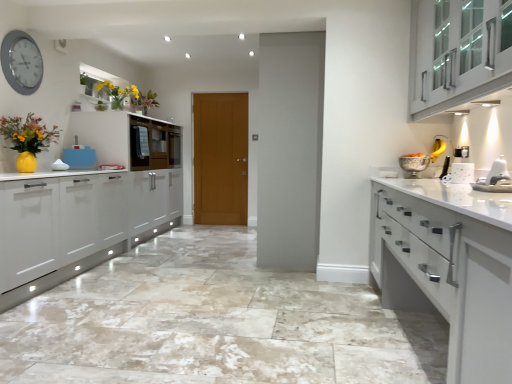
Question: Is white glossy cabinet at right, which is the second cabinetry in left-to-right order, a part of matte glass vase at upper left, the first floral arrangement when ordered from back to front?

Choices:
 (A) yes
 (B) no

Answer: (B)

Question: Is matte glass vase at upper left, the first floral arrangement viewed from the right, looking in the opposite direction of white glossy cabinet at right, marked as the 1th cabinetry in a front-to-back arrangement?

Choices:
 (A) no
 (B) yes

Answer: (A)

Question: Is matte glass vase at upper left, the first floral arrangement viewed from the right, far away from white glossy cabinet at right, which is the second cabinetry in left-to-right order?

Choices:
 (A) yes
 (B) no

Answer: (A)

Question: Can you see matte glass vase at upper left, the first floral arrangement when ordered from back to front, touching white glossy cabinet at right, arranged as the third cabinetry when viewed from the back?

Choices:
 (A) no
 (B) yes

Answer: (A)

Question: Is matte glass vase at upper left, the first floral arrangement viewed from the right, to the left of white glossy cabinet at right, marked as the 1th cabinetry in a front-to-back arrangement, from the viewer's perspective?

Choices:
 (A) no
 (B) yes

Answer: (B)

Question: From a real-world perspective, is matte glass vase at upper left, the first floral arrangement when ordered from back to front, located beneath white glossy cabinet at right, marked as the 1th cabinetry in a front-to-back arrangement?

Choices:
 (A) yes
 (B) no

Answer: (B)

Question: Is white glossy microwave at upper left, which is the third cabinetry from right to left, outside of white glossy cabinet at right, the 2th cabinetry from the right?

Choices:
 (A) yes
 (B) no

Answer: (A)

Question: Is white glossy microwave at upper left, which is the third cabinetry from right to left, oriented away from white glossy cabinet at right, arranged as the third cabinetry when viewed from the back?

Choices:
 (A) no
 (B) yes

Answer: (A)

Question: Can you confirm if white glossy microwave at upper left, which is counted as the 1th cabinetry, starting from the left, is positioned to the left of white glossy cabinet at right, arranged as the third cabinetry when viewed from the back?

Choices:
 (A) no
 (B) yes

Answer: (B)

Question: From the image's perspective, is white glossy microwave at upper left, placed as the 1th cabinetry when sorted from back to front, below white glossy cabinet at right, arranged as the third cabinetry when viewed from the back?

Choices:
 (A) no
 (B) yes

Answer: (A)

Question: Is white glossy microwave at upper left, which ranks as the third cabinetry in front-to-back order, bigger than white glossy cabinet at right, marked as the 1th cabinetry in a front-to-back arrangement?

Choices:
 (A) yes
 (B) no

Answer: (B)

Question: Is white glossy microwave at upper left, placed as the 1th cabinetry when sorted from back to front, aimed at white glossy cabinet at right, arranged as the third cabinetry when viewed from the back?

Choices:
 (A) no
 (B) yes

Answer: (A)

Question: Is white plastic toaster at right inside silver metallic clock at upper left?

Choices:
 (A) yes
 (B) no

Answer: (B)